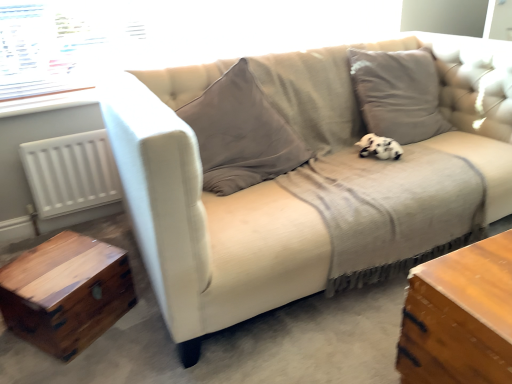
Question: Is black and white plush at center positioned beyond the bounds of wooden trunk at lower left?

Choices:
 (A) yes
 (B) no

Answer: (A)

Question: From the image's perspective, is black and white plush at center beneath wooden trunk at lower left?

Choices:
 (A) yes
 (B) no

Answer: (B)

Question: Is wooden trunk at lower left inside black and white plush at center?

Choices:
 (A) yes
 (B) no

Answer: (B)

Question: Is black and white plush at center positioned in front of wooden trunk at lower left?

Choices:
 (A) no
 (B) yes

Answer: (A)

Question: From a real-world perspective, is black and white plush at center beneath wooden trunk at lower left?

Choices:
 (A) yes
 (B) no

Answer: (B)

Question: Is black and white plush at center far from wooden trunk at lower left?

Choices:
 (A) yes
 (B) no

Answer: (A)

Question: Could you tell me if transparent glass window at upper left is turned towards black and white plush at center?

Choices:
 (A) yes
 (B) no

Answer: (B)

Question: Considering the relative sizes of transparent glass window at upper left and black and white plush at center in the image provided, is transparent glass window at upper left wider than black and white plush at center?

Choices:
 (A) yes
 (B) no

Answer: (B)

Question: Can you confirm if transparent glass window at upper left is positioned to the right of black and white plush at center?

Choices:
 (A) yes
 (B) no

Answer: (B)

Question: Does transparent glass window at upper left appear on the left side of black and white plush at center?

Choices:
 (A) yes
 (B) no

Answer: (A)

Question: From the image's perspective, is transparent glass window at upper left on top of black and white plush at center?

Choices:
 (A) no
 (B) yes

Answer: (B)

Question: Does transparent glass window at upper left have a greater height compared to black and white plush at center?

Choices:
 (A) no
 (B) yes

Answer: (B)

Question: Could you tell me if beige fabric couch at center is facing white matte radiator at left?

Choices:
 (A) yes
 (B) no

Answer: (B)